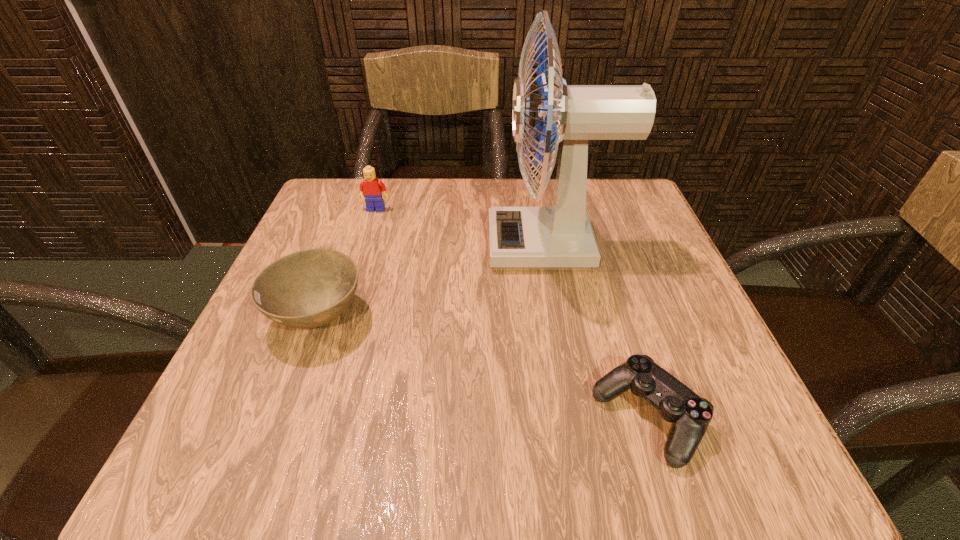
The image size is (960, 540). In order to click on the tallest object in this screenshot , I will do `click(559, 237)`.

Locate an element on the screen. This screenshot has width=960, height=540. Lego is located at coordinates (371, 188).

This screenshot has width=960, height=540. In order to click on bowl in this screenshot , I will do `click(310, 288)`.

Find the location of a particular element. The image size is (960, 540). control is located at coordinates (690, 414).

Locate an element on the screen. The image size is (960, 540). the nearest object is located at coordinates (690, 414).

Identify the location of free region located 0.310m on the front-facing side of the tallest object. (336, 246).

Find the location of a particular element. The width and height of the screenshot is (960, 540). vacant area located 0.370m on the front-facing side of the tallest object is located at coordinates (306, 246).

What are the coordinates of `vacant region located 0.130m on the front-facing side of the tallest object` in the screenshot? It's located at (425, 246).

The height and width of the screenshot is (540, 960). I want to click on free space located on the face of the Lego, so click(x=370, y=231).

Where is `vacant region located 0.080m on the right of the third tallest object`? The width and height of the screenshot is (960, 540). vacant region located 0.080m on the right of the third tallest object is located at coordinates (414, 318).